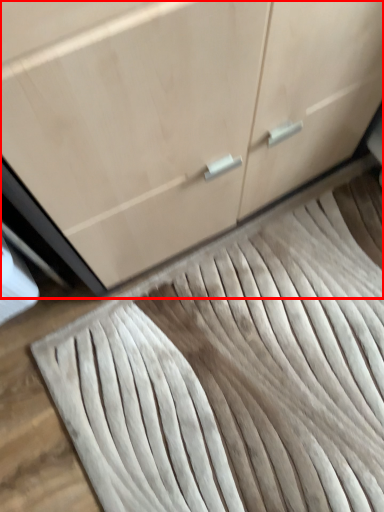
Question: Considering the relative positions of cabinetry (annotated by the red box) and doormat in the image provided, where is cabinetry (annotated by the red box) located with respect to the staircase?

Choices:
 (A) right
 (B) left

Answer: (B)